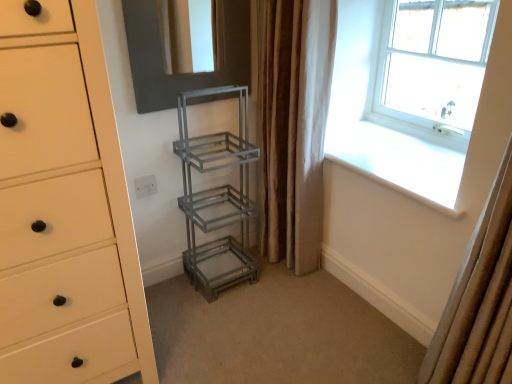
Find the location of a particular element. The height and width of the screenshot is (384, 512). free spot above metallic gray shelving unit at center (from a real-world perspective) is located at coordinates (265, 326).